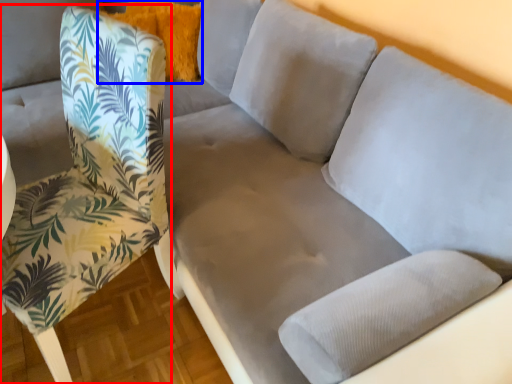
Question: Among these objects, which one is farthest to the camera, chair (highlighted by a red box) or pillow (highlighted by a blue box)?

Choices:
 (A) chair
 (B) pillow

Answer: (B)